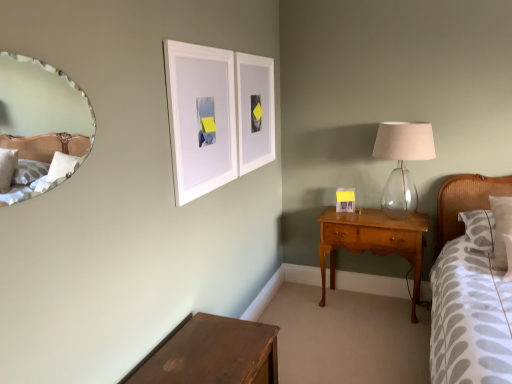
I want to click on vacant position to the left of light brown wood nightstand at center right, so click(308, 312).